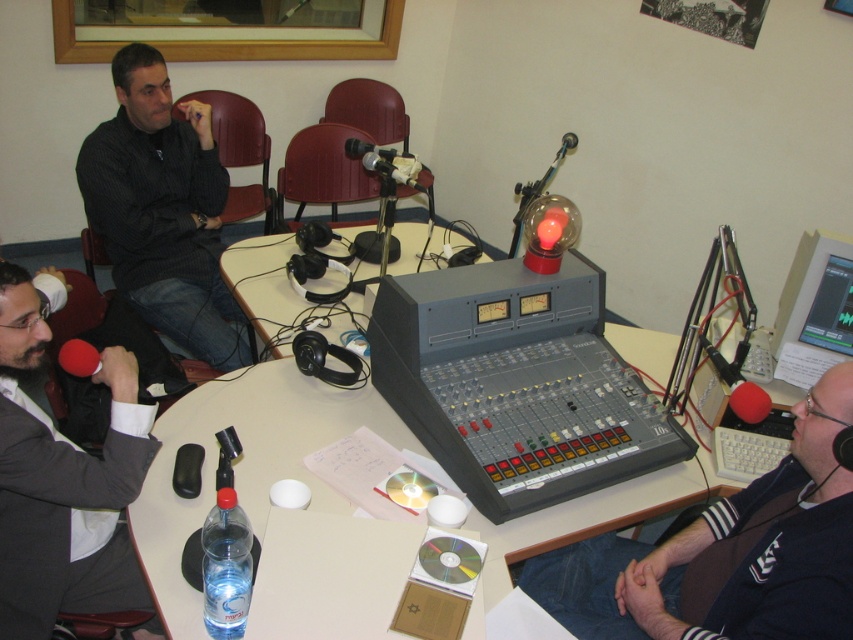
Is point (654, 378) closer to camera compared to point (12, 364)?

That is False.

Is white plastic table at center below gray suit jacket at left?

No, white plastic table at center is not below gray suit jacket at left.

Does point (287, 381) come farther from viewer compared to point (73, 561)?

Yes, point (287, 381) is behind point (73, 561).

At what (x,y) coordinates should I click in order to perform the action: click on white plastic table at center. Please return your answer as a coordinate pair (x, y). Looking at the image, I should click on (245, 465).

Is black matte microphone at lower right smaller than gray suit jacket at left?

Actually, black matte microphone at lower right might be larger than gray suit jacket at left.

Is black matte microphone at lower right below gray suit jacket at left?

Correct, black matte microphone at lower right is located below gray suit jacket at left.

Is point (747, 538) closer to camera compared to point (96, 499)?

Yes.

Find the location of a particular element. black matte microphone at lower right is located at coordinates (727, 554).

Is white plastic table at center above black striped shirt at upper left?

Actually, white plastic table at center is below black striped shirt at upper left.

Which of these two, white plastic table at center or black striped shirt at upper left, stands taller?

black striped shirt at upper left is taller.

Describe the element at coordinates (245, 465) in the screenshot. The width and height of the screenshot is (853, 640). I see `white plastic table at center` at that location.

You are a GUI agent. You are given a task and a screenshot of the screen. Output one action in this format:
    pyautogui.click(x=<x>, y=<y>)
    Task: Click on the white plastic table at center
    Image resolution: width=853 pixels, height=640 pixels.
    Given the screenshot: What is the action you would take?
    pyautogui.click(x=245, y=465)